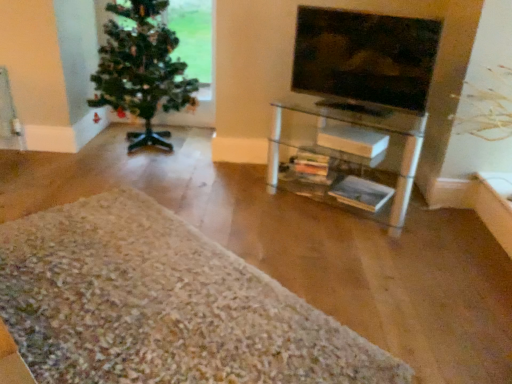
What do you see at coordinates (141, 70) in the screenshot? This screenshot has width=512, height=384. I see `green matte christmas tree at left` at bounding box center [141, 70].

I want to click on matte glass tv at upper right, so click(365, 57).

From the image's perspective, is clear glass shelf at center under green matte christmas tree at left?

Correct, clear glass shelf at center appears lower than green matte christmas tree at left in the image.

Is point (272, 119) more distant than point (147, 93)?

No, (272, 119) is closer to viewer.

Locate an element on the screen. Image resolution: width=512 pixels, height=384 pixels. houseplant that is behind the clear glass shelf at center is located at coordinates (141, 70).

Is clear glass shelf at center touching green matte christmas tree at left?

clear glass shelf at center and green matte christmas tree at left are not in contact.

From the image's perspective, which one is positioned higher, matte glass tv at upper right or white shaggy rug at lower left?

matte glass tv at upper right.

Is point (410, 89) positioned before point (166, 367)?

No, it is not.

Considering the relative sizes of matte glass tv at upper right and white shaggy rug at lower left in the image provided, is matte glass tv at upper right smaller than white shaggy rug at lower left?

Yes.

Identify the location of houseplant that appears below the matte glass tv at upper right (from a real-world perspective). (141, 70).

Looking at the image, does matte glass tv at upper right seem bigger or smaller compared to green matte christmas tree at left?

matte glass tv at upper right is smaller than green matte christmas tree at left.

Is matte glass tv at upper right shorter than green matte christmas tree at left?

Correct, matte glass tv at upper right is not as tall as green matte christmas tree at left.

From the image's perspective, which one is positioned higher, green matte christmas tree at left or matte glass tv at upper right?

green matte christmas tree at left is shown above in the image.

Is green matte christmas tree at left far from matte glass tv at upper right?

That's right, there is a large distance between green matte christmas tree at left and matte glass tv at upper right.

This screenshot has width=512, height=384. I want to click on television on the right of green matte christmas tree at left, so click(365, 57).

Does green matte christmas tree at left touch clear glass shelf at center?

No, green matte christmas tree at left is not with clear glass shelf at center.

Which is behind, green matte christmas tree at left or clear glass shelf at center?

green matte christmas tree at left is further away from the camera.

Considering the positions of points (163, 2) and (407, 203), is point (163, 2) farther from camera compared to point (407, 203)?

Yes.

Considering the sizes of objects green matte christmas tree at left and clear glass shelf at center in the image provided, who is taller, green matte christmas tree at left or clear glass shelf at center?

green matte christmas tree at left is taller.

Considering the relative positions of white shaggy rug at lower left and green matte christmas tree at left in the image provided, is white shaggy rug at lower left to the left of green matte christmas tree at left from the viewer's perspective?

Incorrect, white shaggy rug at lower left is not on the left side of green matte christmas tree at left.

How many degrees apart are the facing directions of white shaggy rug at lower left and green matte christmas tree at left?

46.6 degrees separate the facing orientations of white shaggy rug at lower left and green matte christmas tree at left.

Could you tell me if white shaggy rug at lower left is turned towards green matte christmas tree at left?

No, white shaggy rug at lower left is not turned towards green matte christmas tree at left.

Considering the positions of objects green matte christmas tree at left and white shaggy rug at lower left in the image provided, who is more to the right, green matte christmas tree at left or white shaggy rug at lower left?

From the viewer's perspective, white shaggy rug at lower left appears more on the right side.

Is white shaggy rug at lower left at the back of green matte christmas tree at left?

No, green matte christmas tree at left is not facing the opposite direction of white shaggy rug at lower left.

Considering the relative sizes of green matte christmas tree at left and white shaggy rug at lower left in the image provided, is green matte christmas tree at left wider than white shaggy rug at lower left?

Incorrect, the width of green matte christmas tree at left does not surpass that of white shaggy rug at lower left.

There is a clear glass shelf at center. Where is `houseplant above it (from a real-world perspective)`? houseplant above it (from a real-world perspective) is located at coordinates (141, 70).

Locate an element on the screen. The height and width of the screenshot is (384, 512). television that is behind the white shaggy rug at lower left is located at coordinates (365, 57).

Which object lies nearer to the anchor point clear glass shelf at center, matte glass tv at upper right or green matte christmas tree at left?

matte glass tv at upper right.

When comparing their distances from green matte christmas tree at left, does clear glass shelf at center or matte glass tv at upper right seem closer?

clear glass shelf at center lies closer to green matte christmas tree at left than the other object.

From the image, which object appears to be nearer to green matte christmas tree at left, matte glass tv at upper right or clear glass shelf at center?

clear glass shelf at center lies closer to green matte christmas tree at left than the other object.

Based on their spatial positions, is clear glass shelf at center or white shaggy rug at lower left closer to green matte christmas tree at left?

Based on the image, clear glass shelf at center appears to be nearer to green matte christmas tree at left.

Considering their positions, is green matte christmas tree at left positioned closer to matte glass tv at upper right than white shaggy rug at lower left?

green matte christmas tree at left is positioned closer to the anchor matte glass tv at upper right.

Based on their spatial positions, is clear glass shelf at center or matte glass tv at upper right further from white shaggy rug at lower left?

Based on the image, matte glass tv at upper right appears to be further to white shaggy rug at lower left.

Considering their positions, is white shaggy rug at lower left positioned further to matte glass tv at upper right than clear glass shelf at center?

white shaggy rug at lower left.

Based on their spatial positions, is matte glass tv at upper right or white shaggy rug at lower left further from green matte christmas tree at left?

white shaggy rug at lower left is further to green matte christmas tree at left.

This screenshot has height=384, width=512. What are the coordinates of `shelf between white shaggy rug at lower left and green matte christmas tree at left in the front-back direction` in the screenshot? It's located at (358, 125).

In order to click on television between green matte christmas tree at left and clear glass shelf at center in the horizontal direction in this screenshot , I will do `click(365, 57)`.

At what (x,y) coordinates should I click in order to perform the action: click on television between white shaggy rug at lower left and clear glass shelf at center along the z-axis. Please return your answer as a coordinate pair (x, y). Looking at the image, I should click on [365, 57].

The height and width of the screenshot is (384, 512). I want to click on television between white shaggy rug at lower left and green matte christmas tree at left along the z-axis, so click(365, 57).